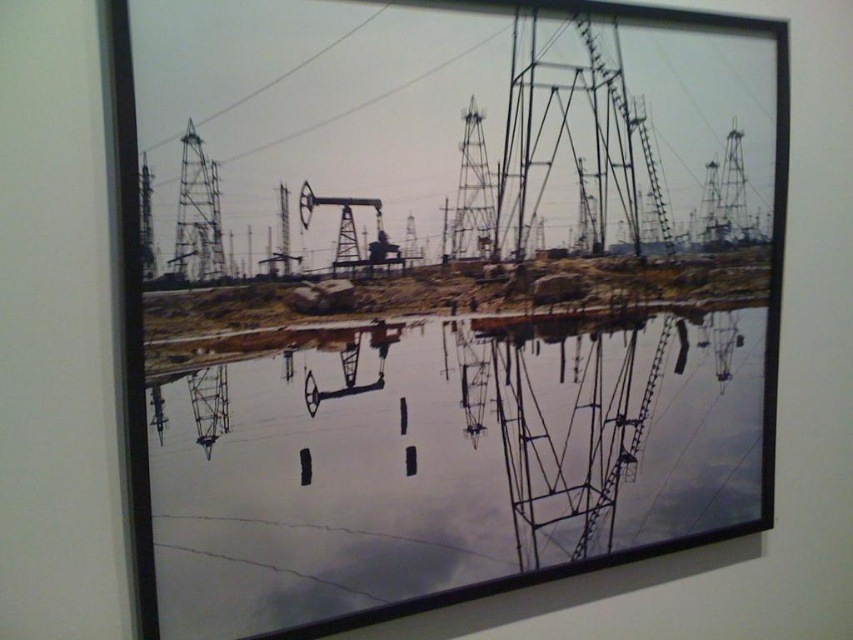
You are standing in front of the framed photograph of an industrial landscape. There is a transparent glass water at center located at point [442,464]. If you want to touch the water in the photograph, can you reach it?

The transparent glass water at center is part of the framed photograph, which is a 2D image. Since it is not a physical object, you cannot physically touch or reach it.

You are an art critic analyzing the photograph. You notice the transparent glass water at center and the metallic wire at upper left. Which object appears closer to you in the image?

The transparent glass water at center appears closer to you than the metallic wire at upper left because it is further to the viewer.

You are an art curator examining the framed photograph. You notice two metallic wires in the upper part of the image. Which one of the two, the metallic wire at upper center or the metallic wire at upper left, is larger in size?

The metallic wire at upper center is bigger than the metallic wire at upper left.